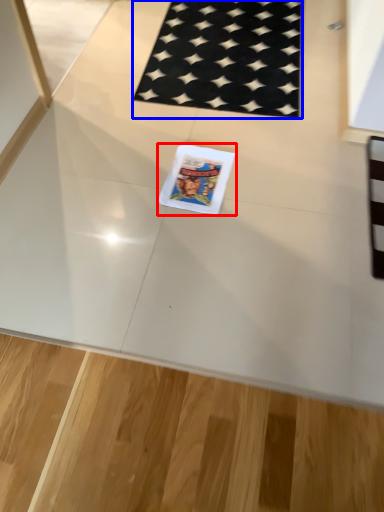
Question: Which object is further to the camera taking this photo, comic book (highlighted by a red box) or mat (highlighted by a blue box)?

Choices:
 (A) comic book
 (B) mat

Answer: (B)